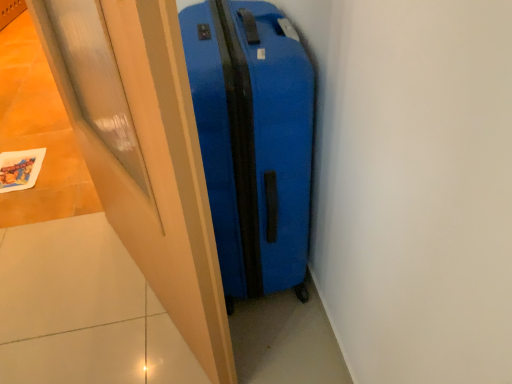
Question: Does matte wood door at center have a greater height compared to blue matte suitcase at center?

Choices:
 (A) no
 (B) yes

Answer: (B)

Question: Is blue matte suitcase at center a part of matte wood door at center?

Choices:
 (A) no
 (B) yes

Answer: (A)

Question: From a real-world perspective, is matte wood door at center under blue matte suitcase at center?

Choices:
 (A) yes
 (B) no

Answer: (B)

Question: Does matte wood door at center lie behind blue matte suitcase at center?

Choices:
 (A) yes
 (B) no

Answer: (B)

Question: Is blue matte suitcase at center at the back of matte wood door at center?

Choices:
 (A) no
 (B) yes

Answer: (B)

Question: Is matte wood door at center thinner than blue matte suitcase at center?

Choices:
 (A) no
 (B) yes

Answer: (B)

Question: Can you confirm if blue matte suitcase at center is smaller than matte wood door at center?

Choices:
 (A) yes
 (B) no

Answer: (B)

Question: From a real-world perspective, is blue matte suitcase at center under matte wood door at center?

Choices:
 (A) no
 (B) yes

Answer: (B)

Question: Can you confirm if blue matte suitcase at center is shorter than matte wood door at center?

Choices:
 (A) yes
 (B) no

Answer: (A)

Question: Can you confirm if blue matte suitcase at center is positioned to the right of matte wood door at center?

Choices:
 (A) no
 (B) yes

Answer: (B)

Question: Is the position of blue matte suitcase at center less distant than that of matte wood door at center?

Choices:
 (A) yes
 (B) no

Answer: (B)

Question: Can you confirm if blue matte suitcase at center is taller than matte wood door at center?

Choices:
 (A) no
 (B) yes

Answer: (A)

Question: Relative to matte wood door at center, is blue matte suitcase at center in front or behind?

Choices:
 (A) front
 (B) behind

Answer: (B)